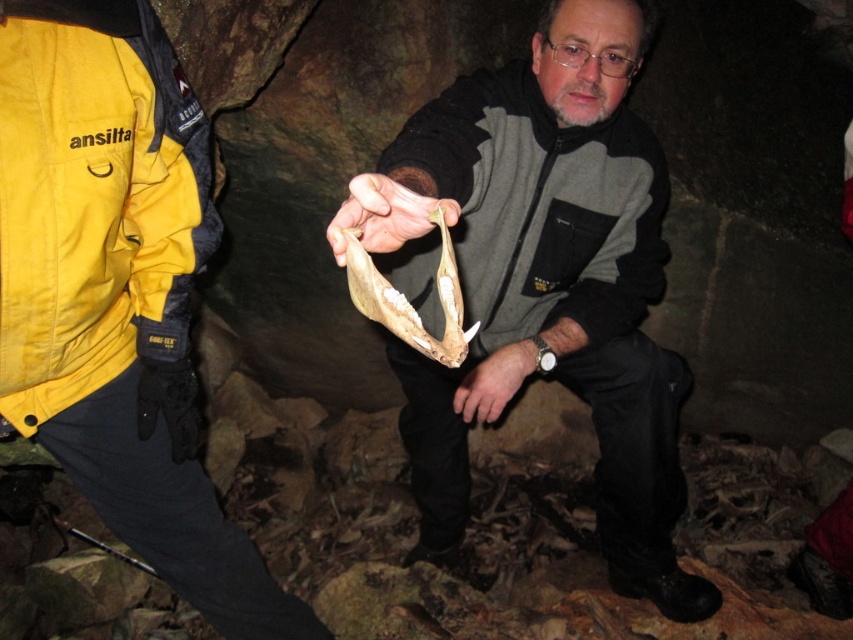
Does matte black jacket at center come in front of yellow fabric jacket at left?

No, matte black jacket at center is further to the viewer.

Is point (19, 212) positioned before point (108, 413)?

Yes, it is in front of point (108, 413).

Which is behind, point (6, 412) or point (36, 390)?

Positioned behind is point (36, 390).

Where is `matte black jacket at center`? matte black jacket at center is located at coordinates (117, 292).

Does yellow fabric jacket at left have a larger size compared to smooth bone at center?

Indeed, yellow fabric jacket at left has a larger size compared to smooth bone at center.

Between yellow fabric jacket at left and smooth bone at center, which one appears on the left side from the viewer's perspective?

yellow fabric jacket at left is more to the left.

Find the location of `yellow fabric jacket at left`. yellow fabric jacket at left is located at coordinates (99, 230).

The image size is (853, 640). What are the coordinates of `yellow fabric jacket at left` in the screenshot? It's located at (99, 230).

Who is lower down, gray fleece jacket at center or smooth bone at center?

smooth bone at center is lower down.

Does gray fleece jacket at center appear under smooth bone at center?

No.

Image resolution: width=853 pixels, height=640 pixels. What are the coordinates of `gray fleece jacket at center` in the screenshot? It's located at (541, 205).